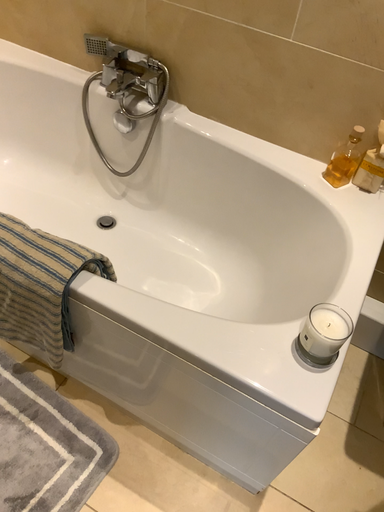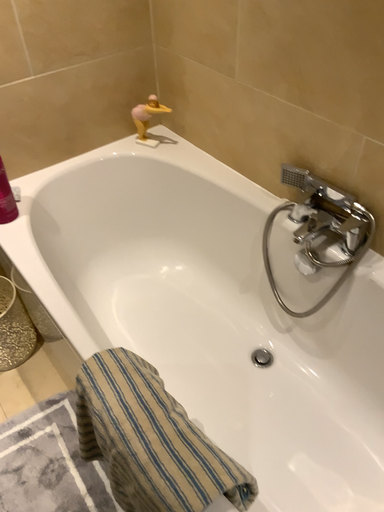
Question: Which way did the camera rotate in the video?

Choices:
 (A) rotated downward
 (B) rotated upward

Answer: (B)